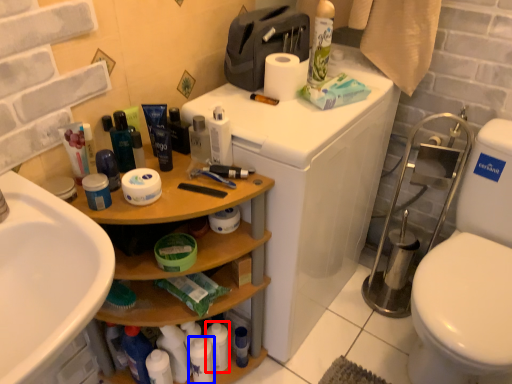
Question: Which object is closer to the camera taking this photo, toiletry (highlighted by a red box) or toiletry (highlighted by a blue box)?

Choices:
 (A) toiletry
 (B) toiletry

Answer: (B)